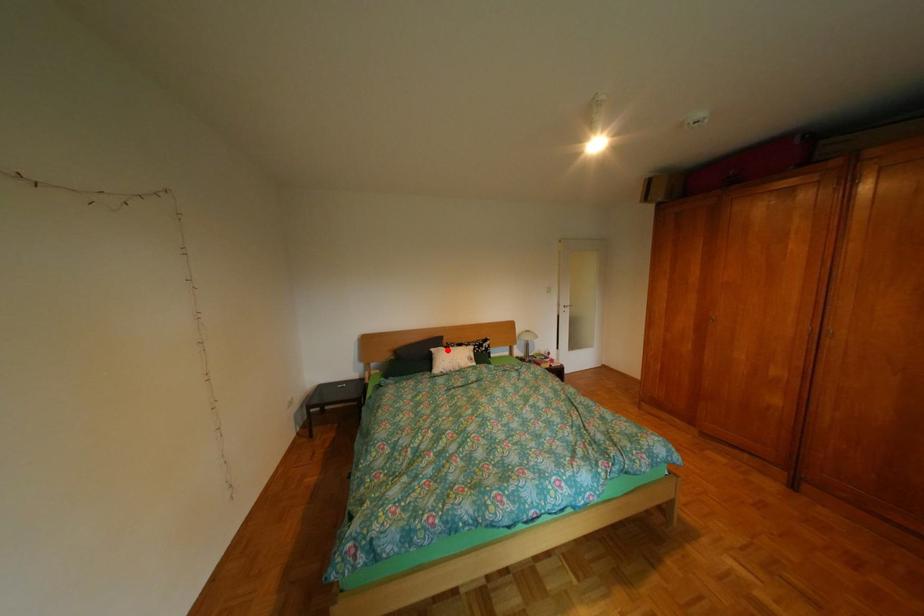
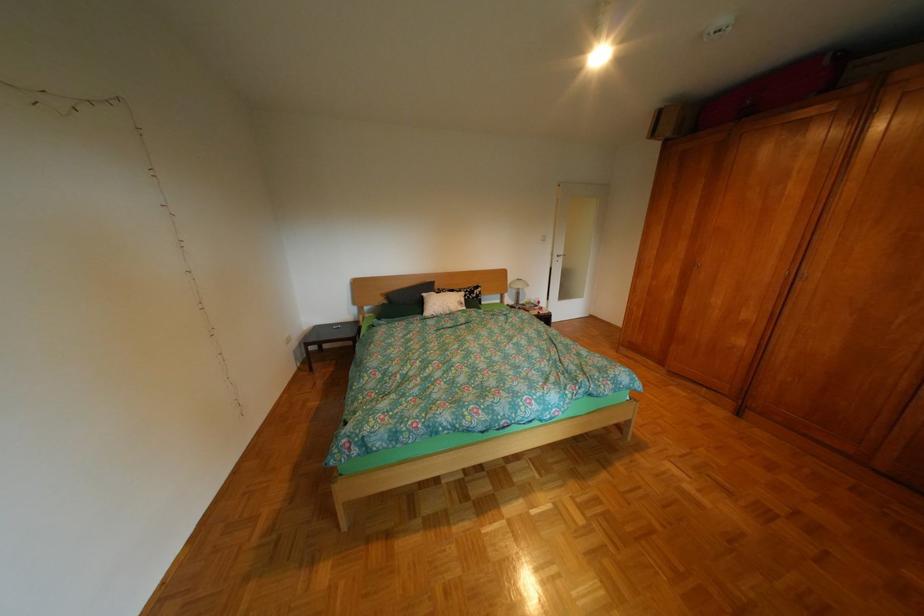
Question: I am providing you with two images of the same scene from different viewpoints. In image1, a red point is highlighted. Considering the same 3D point in image2, which of the following is correct?

Choices:
 (A) It is closer
 (B) It is farther

Answer: (A)